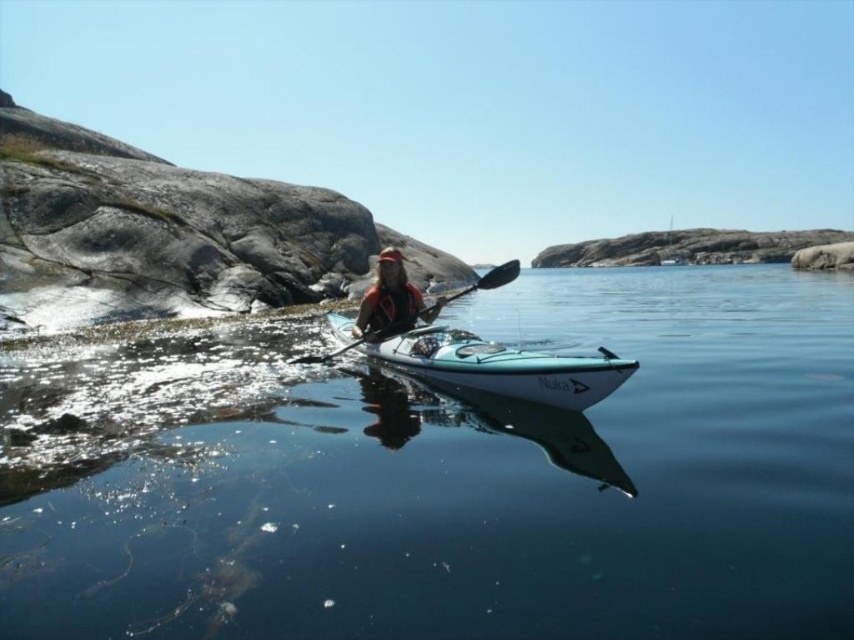
What do you see at coordinates (502, 365) in the screenshot? I see `teal glossy canoe at center` at bounding box center [502, 365].

Where is `teal glossy canoe at center`? teal glossy canoe at center is located at coordinates (502, 365).

Which is behind, point (583, 380) or point (392, 276)?

The point (392, 276) is more distant.

Where is `teal glossy canoe at center`? This screenshot has width=854, height=640. teal glossy canoe at center is located at coordinates (502, 365).

The image size is (854, 640). What are the coordinates of `teal glossy canoe at center` in the screenshot? It's located at (502, 365).

Where is `teal glossy canoe at center`? The image size is (854, 640). teal glossy canoe at center is located at coordinates (502, 365).

Looking at this image, is clear blue water at center wider than teal glossy canoe at center?

Correct, the width of clear blue water at center exceeds that of teal glossy canoe at center.

Is clear blue water at center closer to camera compared to teal glossy canoe at center?

Yes, it is in front of teal glossy canoe at center.

The width and height of the screenshot is (854, 640). Describe the element at coordinates (490, 490) in the screenshot. I see `clear blue water at center` at that location.

At what (x,y) coordinates should I click in order to perform the action: click on clear blue water at center. Please return your answer as a coordinate pair (x, y). This screenshot has width=854, height=640. Looking at the image, I should click on (490, 490).